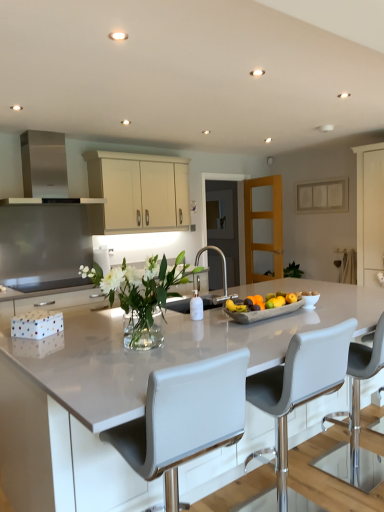
I want to click on vacant area situated below clear glass vase at center (from a real-world perspective), so click(x=136, y=352).